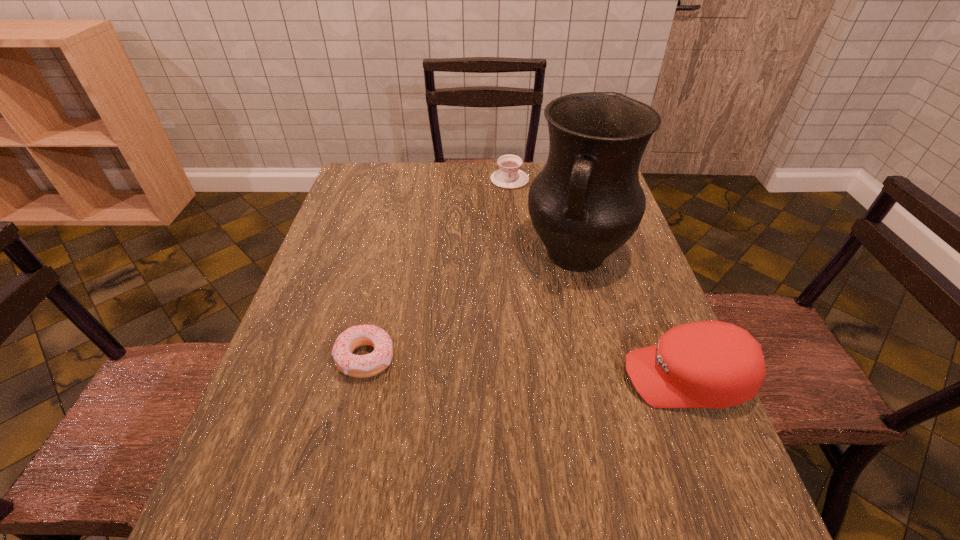
At what (x,y) coordinates should I click in order to perform the action: click on doughnut. Please return your answer as a coordinate pair (x, y). Looking at the image, I should click on (359, 366).

Where is `the leftmost object`? the leftmost object is located at coordinates (359, 366).

Where is `the third shortest object`? The image size is (960, 540). the third shortest object is located at coordinates (707, 364).

Locate an element on the screen. This screenshot has height=540, width=960. pitcher is located at coordinates (587, 202).

Where is `the tallest object`? The width and height of the screenshot is (960, 540). the tallest object is located at coordinates (587, 202).

In order to click on the third tallest object in this screenshot , I will do `click(509, 176)`.

What are the coordinates of `the farthest object` in the screenshot? It's located at (509, 176).

Locate an element on the screen. free spot located 0.290m on the back of the shortest object is located at coordinates (390, 254).

Image resolution: width=960 pixels, height=540 pixels. I want to click on free space located on the front-facing side of the second tallest object, so click(509, 378).

Identify the location of free space located 0.100m on the front-facing side of the second tallest object. (575, 378).